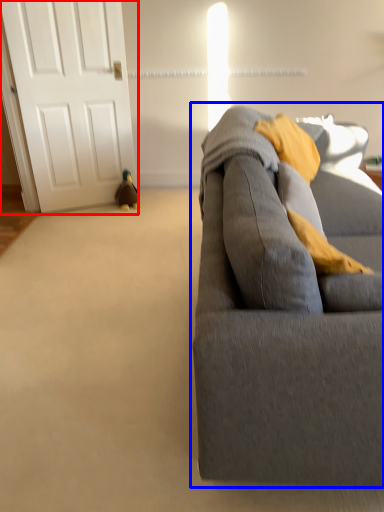
Question: Which of the following is the farthest to the observer, door (highlighted by a red box) or studio couch (highlighted by a blue box)?

Choices:
 (A) door
 (B) studio couch

Answer: (A)